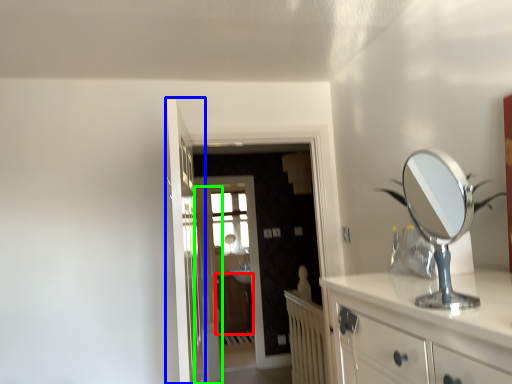
Question: Which object is positioned closest to cabinetry (highlighted by a red box)? Select from door (highlighted by a blue box) and door (highlighted by a green box).

Choices:
 (A) door
 (B) door

Answer: (B)